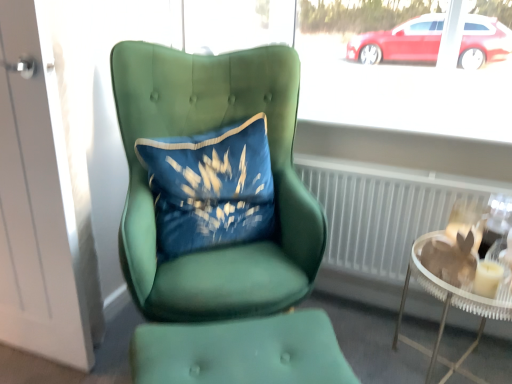
At what (x,y) coordinates should I click in order to perform the action: click on unoccupied region to the right of white matte door at left. Please return your answer as a coordinate pair (x, y). This screenshot has height=384, width=512. Looking at the image, I should click on (118, 344).